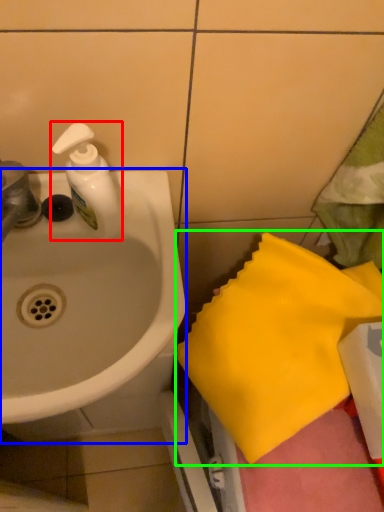
Question: Estimate the real-world distances between objects in this image. Which object is closer to soap dispenser (highlighted by a red box), sink (highlighted by a blue box) or beach towel (highlighted by a green box)?

Choices:
 (A) sink
 (B) beach towel

Answer: (A)